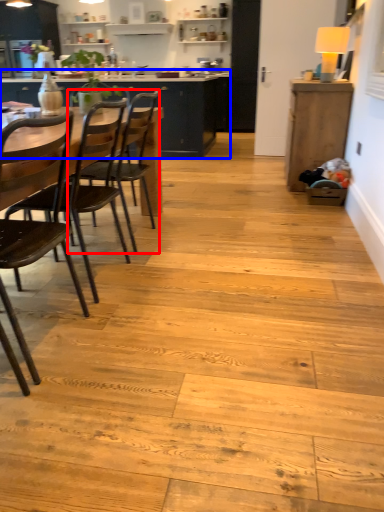
Question: Which of the following is the farthest to the observer, chair (highlighted by a red box) or cabinetry (highlighted by a blue box)?

Choices:
 (A) chair
 (B) cabinetry

Answer: (B)